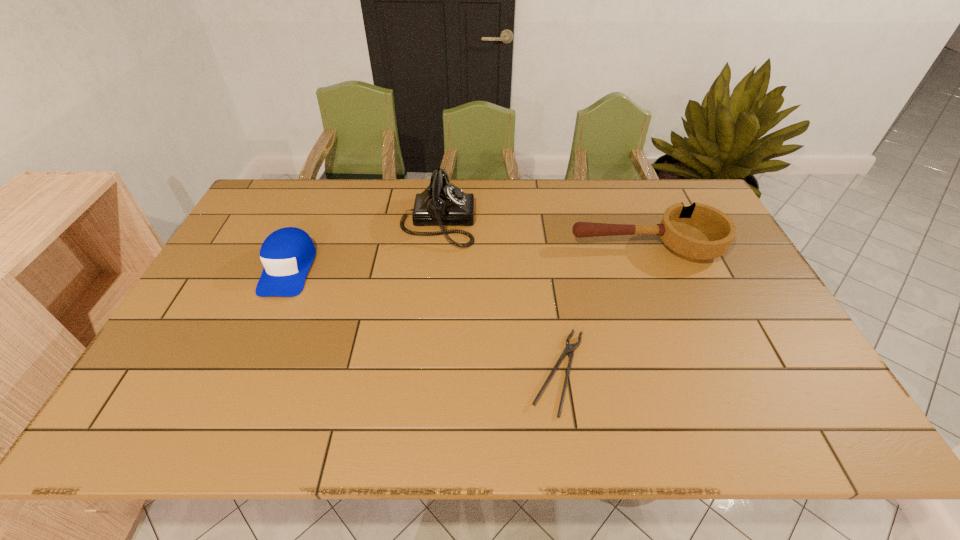
Identify the location of free location that satisfies the following two spatial constraints: 1. on the dial of the second object from left to right; 2. with the handle on the side of the saucepan. This screenshot has width=960, height=540. (435, 246).

Identify the location of vacant region that satisfies the following two spatial constraints: 1. on the dial of the telephone; 2. on the front-facing side of the baseball cap. (433, 268).